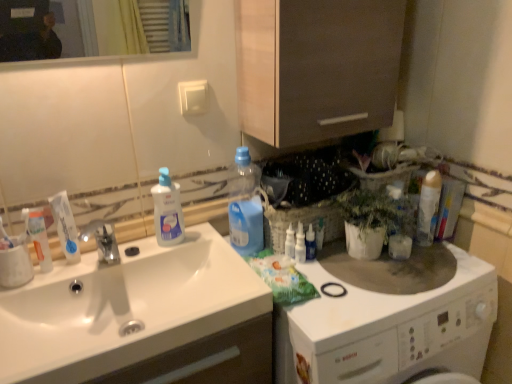
The width and height of the screenshot is (512, 384). What are the coordinates of `vacant space that is to the left of white matte aerosol can at upper right, marked as the first cleaning product in a right-to-left arrangement` in the screenshot? It's located at (367, 262).